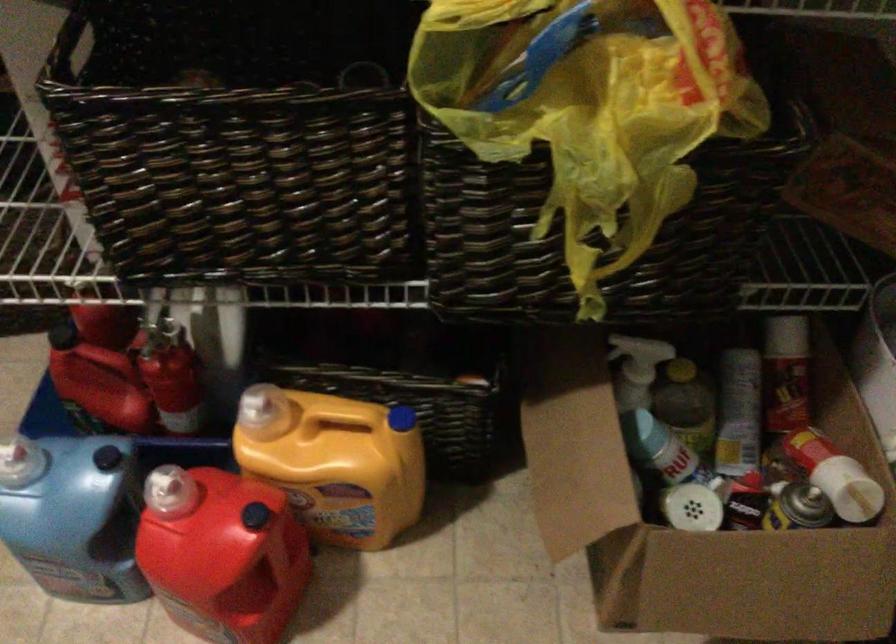
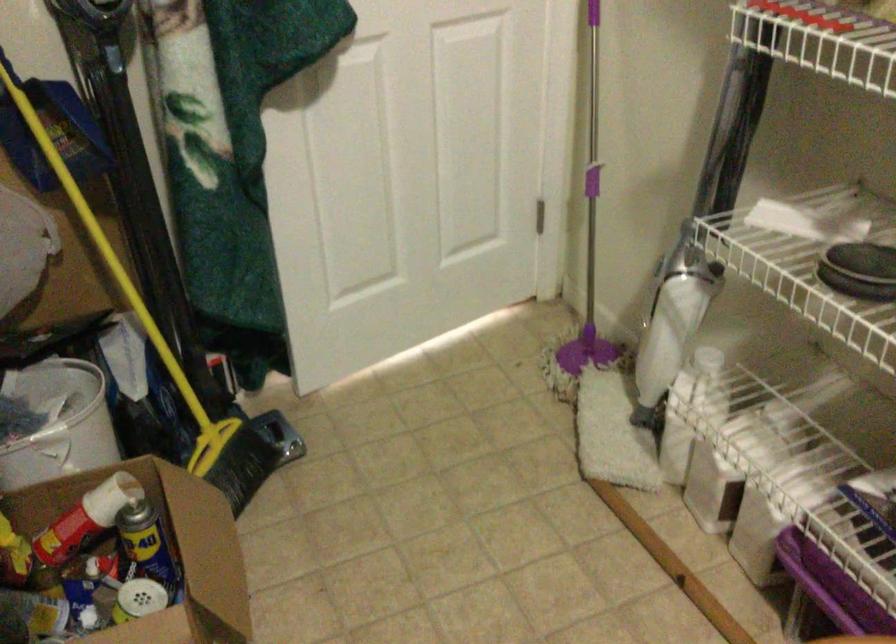
Where in the second image is the point corresponding to (x=764, y=516) from the first image?

(147, 547)